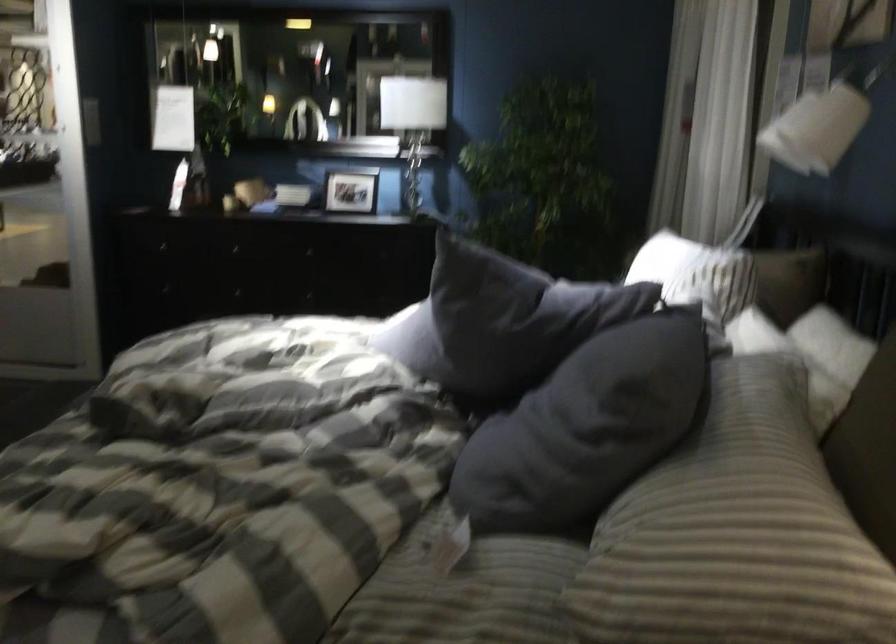
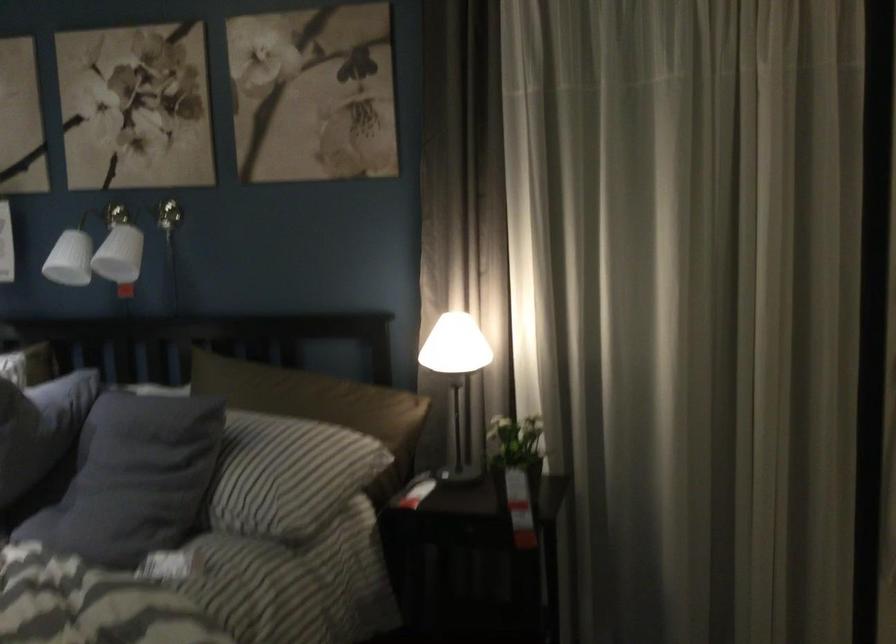
Question: I am providing you with two images of the same scene from different viewpoints. Which of the following objects are not visible in image2?

Choices:
 (A) blue-gray pillow
 (B) brown pillow
 (C) white table lamp
 (D) none of these

Answer: (D)